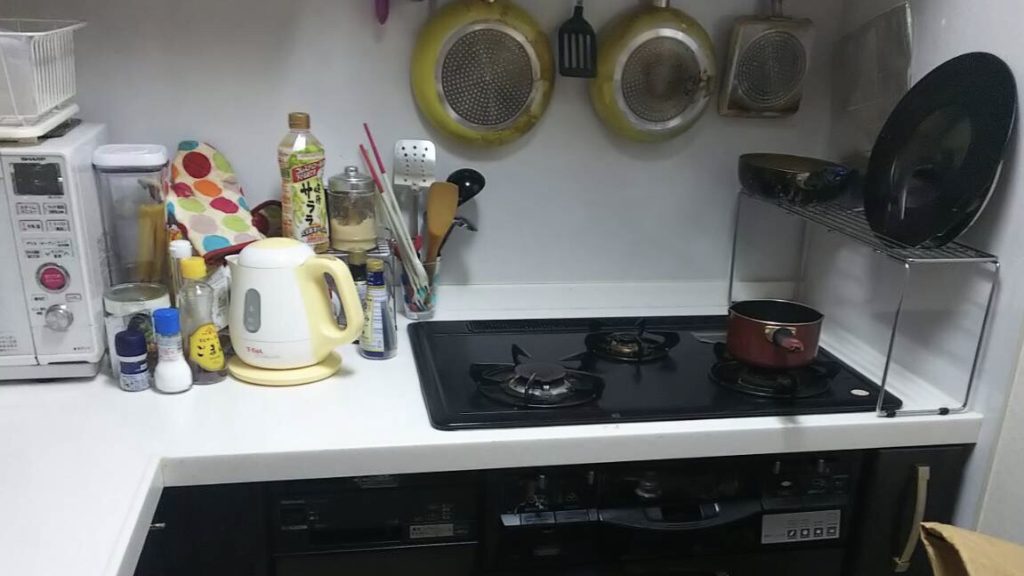
Where is `microwave`? This screenshot has width=1024, height=576. microwave is located at coordinates (10, 309).